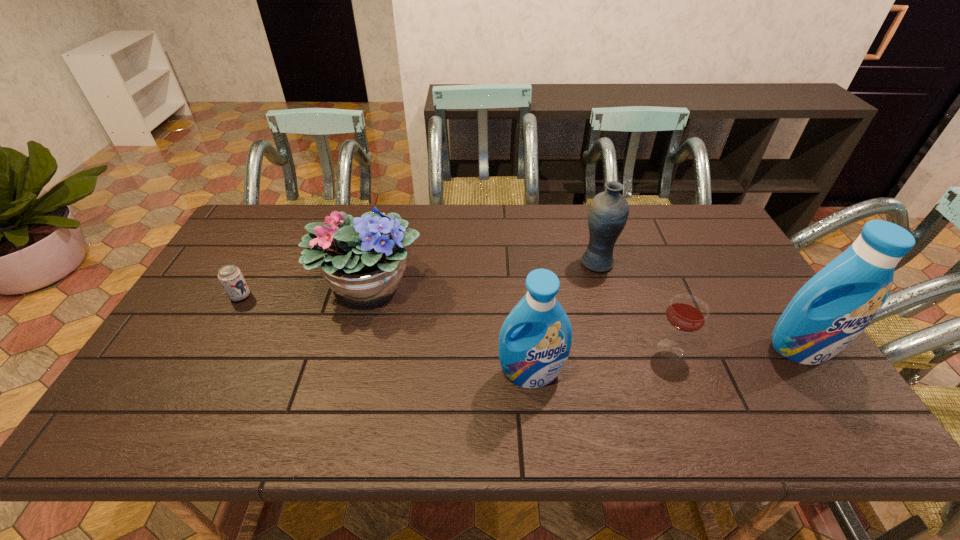
Identify the location of free space located on the back of the bouquet. This screenshot has width=960, height=540. (385, 222).

At what (x,y) coordinates should I click in order to perform the action: click on blank area located on the front of the third object from right to left. Please return your answer as a coordinate pair (x, y). Looking at the image, I should click on (619, 339).

This screenshot has width=960, height=540. Identify the location of vacant space positioned on the left of the second object from right to left. (599, 349).

Where is `free space located 0.340m on the back of the beer can`? This screenshot has width=960, height=540. free space located 0.340m on the back of the beer can is located at coordinates (282, 221).

Locate an element on the screen. This screenshot has width=960, height=540. object that is at the near edge is located at coordinates (535, 339).

Find the location of a particular element. object that is positioned at the left edge is located at coordinates (230, 276).

Where is `object positioned at the right edge`? The width and height of the screenshot is (960, 540). object positioned at the right edge is located at coordinates (837, 304).

Find the location of a particular element. The height and width of the screenshot is (540, 960). free space at the far edge of the desktop is located at coordinates (546, 217).

In the image, there is a desktop. What are the coordinates of `vacant space at the near edge` in the screenshot? It's located at (412, 379).

Locate an element on the screen. The image size is (960, 540). free region at the right edge of the desktop is located at coordinates (743, 278).